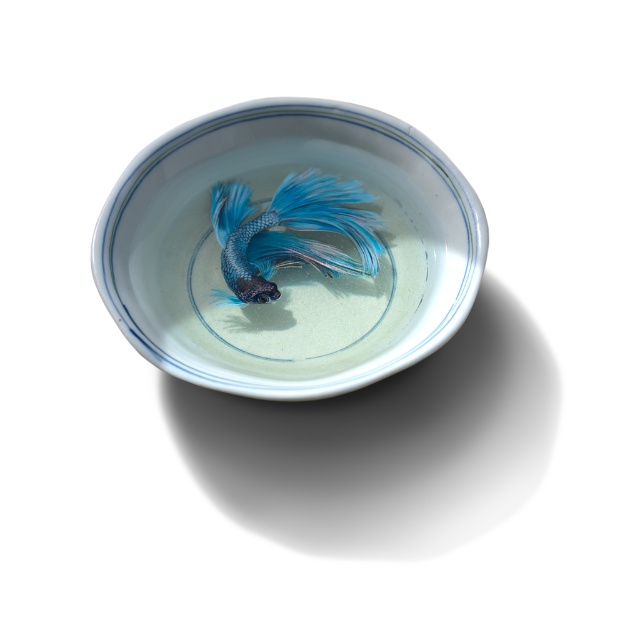
Does porcelain bowl at center have a lesser height compared to blue glossy fish at center?

Incorrect, porcelain bowl at center's height does not fall short of blue glossy fish at center's.

Is porcelain bowl at center to the right of blue glossy fish at center from the viewer's perspective?

In fact, porcelain bowl at center is to the left of blue glossy fish at center.

The image size is (640, 640). I want to click on porcelain bowl at center, so click(291, 268).

In order to click on porcelain bowl at center in this screenshot , I will do `click(291, 268)`.